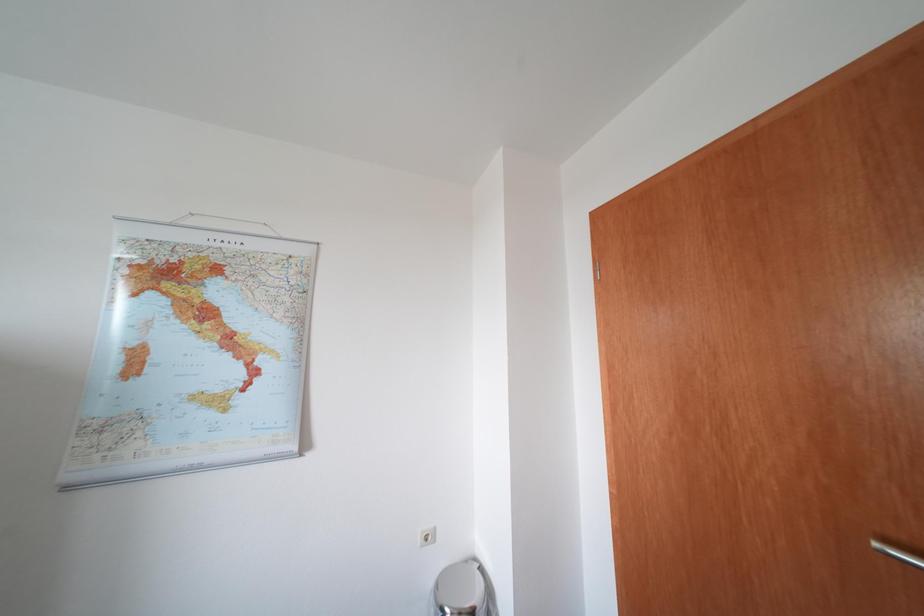
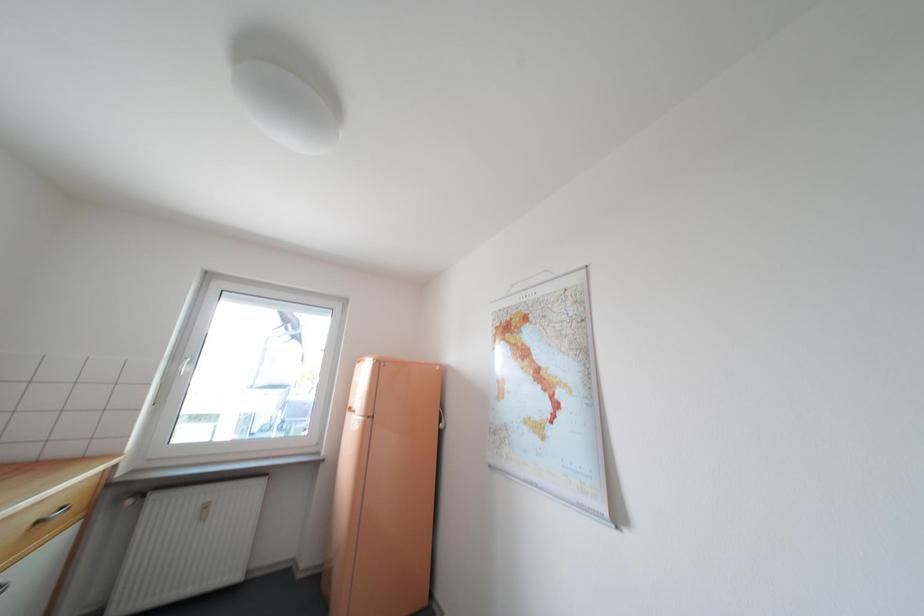
The first image is from the beginning of the video and the second image is from the end. How did the camera likely rotate when shooting the video?

The rotation direction of the camera is left-up.